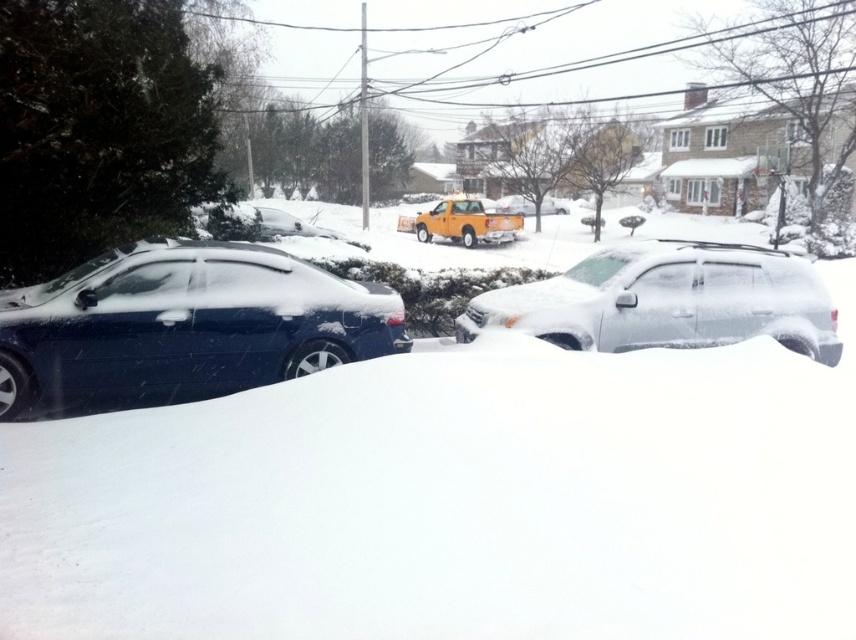
Does white fluffy snow at center have a greater height compared to glossy blue sedan at left?

Indeed, white fluffy snow at center has a greater height compared to glossy blue sedan at left.

Who is more forward, [577,468] or [229,349]?

Point [577,468] is more forward.

Image resolution: width=856 pixels, height=640 pixels. I want to click on white fluffy snow at center, so click(452, 500).

Does glossy blue sedan at left appear on the left side of sleek silver suv at center?

Indeed, glossy blue sedan at left is positioned on the left side of sleek silver suv at center.

Which of these two, glossy blue sedan at left or sleek silver suv at center, stands shorter?

Standing shorter between the two is sleek silver suv at center.

Where is `glossy blue sedan at left`? The image size is (856, 640). glossy blue sedan at left is located at coordinates (183, 324).

At what (x,y) coordinates should I click in order to perform the action: click on glossy blue sedan at left. Please return your answer as a coordinate pair (x, y). The height and width of the screenshot is (640, 856). Looking at the image, I should click on (183, 324).

Does white fluffy snow at center appear over sleek silver suv at center?

No, white fluffy snow at center is not above sleek silver suv at center.

Is white fluffy snow at center shorter than sleek silver suv at center?

No, white fluffy snow at center is not shorter than sleek silver suv at center.

Is point (741, 620) in front of point (538, 324)?

Yes, it is in front of point (538, 324).

I want to click on white fluffy snow at center, so click(x=452, y=500).